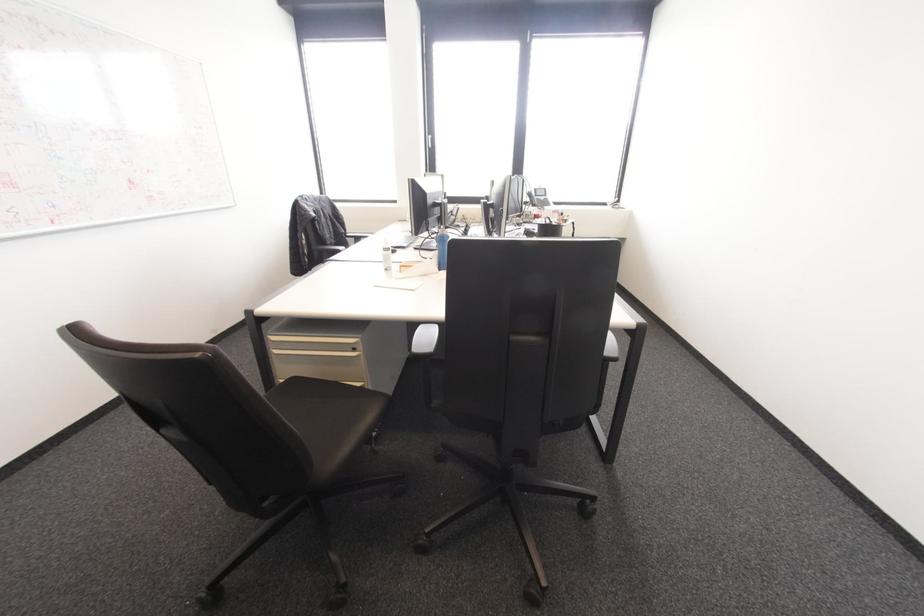
Which object does [442,248] point to?

It corresponds to the blue water bottle in the image.